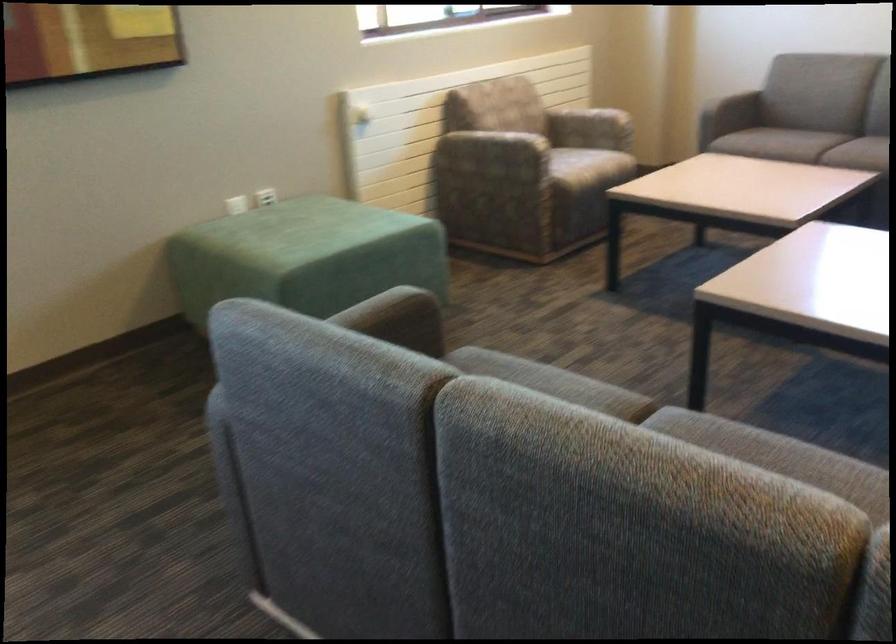
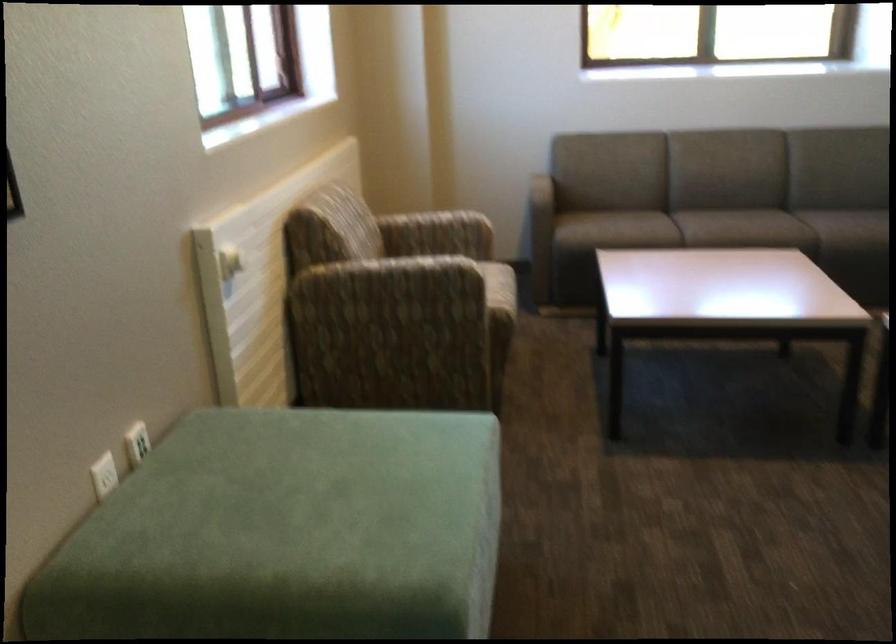
Where in the second image is the point corresponding to (x=259, y=198) from the first image?

(136, 442)